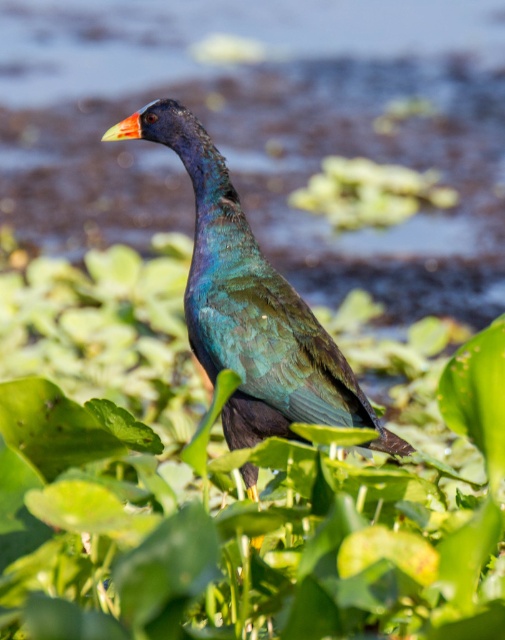
Is green leafy plant at center bigger than metallic iridescent bird at center?

Indeed, green leafy plant at center has a larger size compared to metallic iridescent bird at center.

Can you confirm if green leafy plant at center is positioned above metallic iridescent bird at center?

Incorrect, green leafy plant at center is not positioned above metallic iridescent bird at center.

Is point (216, 422) more distant than point (162, 129)?

No, it is not.

This screenshot has width=505, height=640. Identify the location of green leafy plant at center. (231, 474).